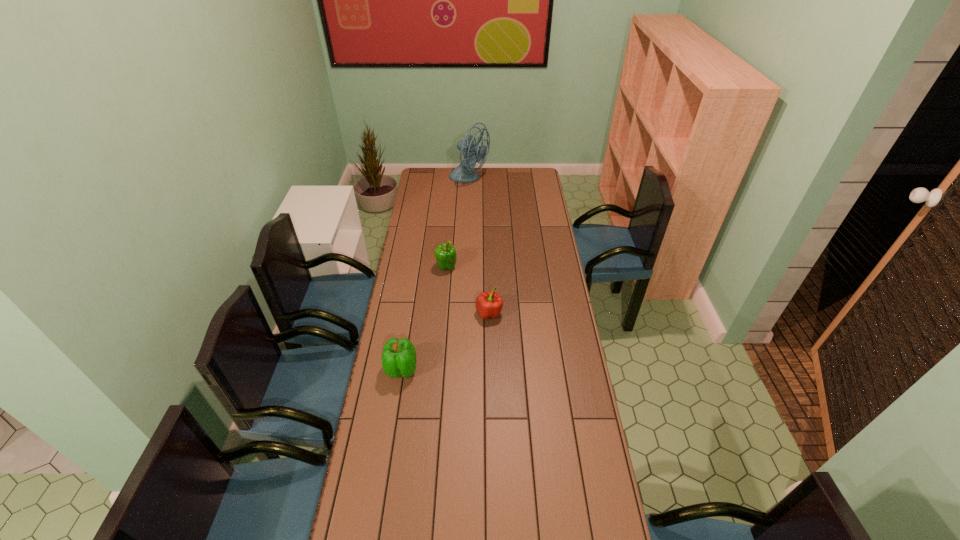
Find the location of `bell pepper object that ranks as the closest to the farthest bell pepper`. bell pepper object that ranks as the closest to the farthest bell pepper is located at coordinates (489, 305).

This screenshot has height=540, width=960. In order to click on free space that satisfies the following two spatial constraints: 1. in front of the third farthest object to blow air; 2. on the left side of the farthest object in this screenshot , I will do `click(465, 313)`.

Find the location of a particular element. vacant region that satisfies the following two spatial constraints: 1. on the back side of the third farthest object; 2. in front of the tallest object to blow air is located at coordinates (487, 179).

The width and height of the screenshot is (960, 540). Find the location of `free space that satisfies the following two spatial constraints: 1. in front of the fan to blow air; 2. on the back side of the shortest object`. free space that satisfies the following two spatial constraints: 1. in front of the fan to blow air; 2. on the back side of the shortest object is located at coordinates (465, 313).

What are the coordinates of `free point that satisfies the following two spatial constraints: 1. in front of the rightmost bell pepper to blow air; 2. on the left side of the tallest object` in the screenshot? It's located at (465, 313).

At what (x,y) coordinates should I click in order to perform the action: click on free location that satisfies the following two spatial constraints: 1. in front of the tallest object to blow air; 2. on the front side of the third nearest object. Please return your answer as a coordinate pair (x, y). Looking at the image, I should click on (467, 267).